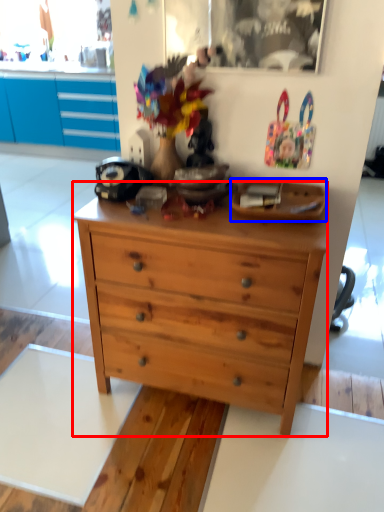
Question: Which object is closer to the camera taking this photo, chest of drawers (highlighted by a red box) or plate (highlighted by a blue box)?

Choices:
 (A) chest of drawers
 (B) plate

Answer: (A)